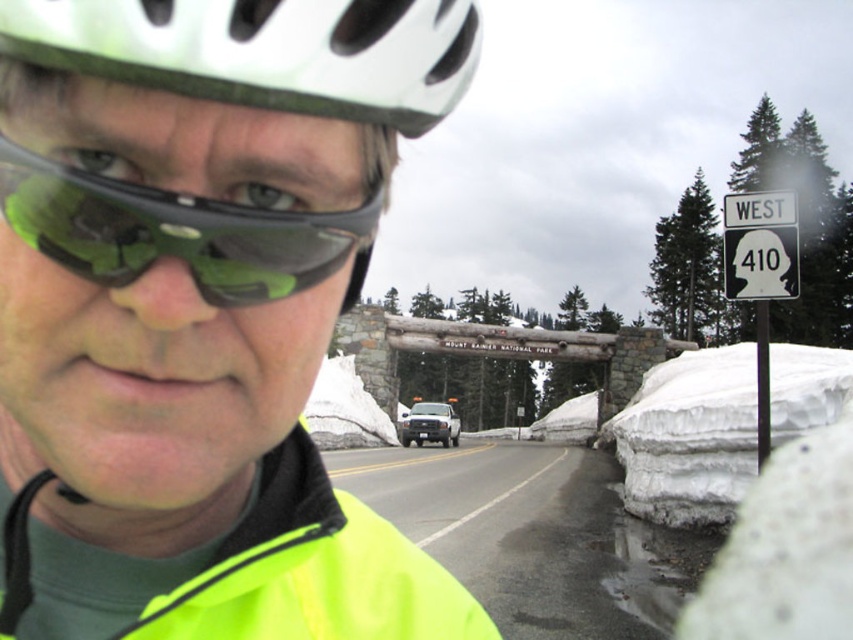
You are a GUI agent. You are given a task and a screenshot of the screen. Output one action in this format:
    pyautogui.click(x=<x>, y=<y>)
    Task: Click on the white matte bicycle helmet at upper center
    The image size is (853, 640).
    Given the screenshot: What is the action you would take?
    pyautogui.click(x=265, y=51)

Which of these two, white matte bicycle helmet at upper center or glossy asphalt road at lower center, stands shorter?

white matte bicycle helmet at upper center is shorter.

You are a GUI agent. You are given a task and a screenshot of the screen. Output one action in this format:
    pyautogui.click(x=<x>, y=<y>)
    Task: Click on the white matte bicycle helmet at upper center
    Image resolution: width=853 pixels, height=640 pixels.
    Given the screenshot: What is the action you would take?
    pyautogui.click(x=265, y=51)

Does neon yellow jacket at center come behind neon yellow fabric safety vest at center?

No.

Does neon yellow jacket at center have a smaller size compared to neon yellow fabric safety vest at center?

No.

Between point (38, 284) and point (146, 634), which one is positioned in front?

Point (38, 284)

Image resolution: width=853 pixels, height=640 pixels. I want to click on neon yellow jacket at center, so click(x=200, y=310).

Which of these two, glossy asphalt road at lower center or white fluffy snow at lower right, stands taller?

white fluffy snow at lower right

Is point (619, 602) positioned behind point (621, 422)?

No, (619, 602) is in front of (621, 422).

Locate an element on the screen. The image size is (853, 640). glossy asphalt road at lower center is located at coordinates (524, 534).